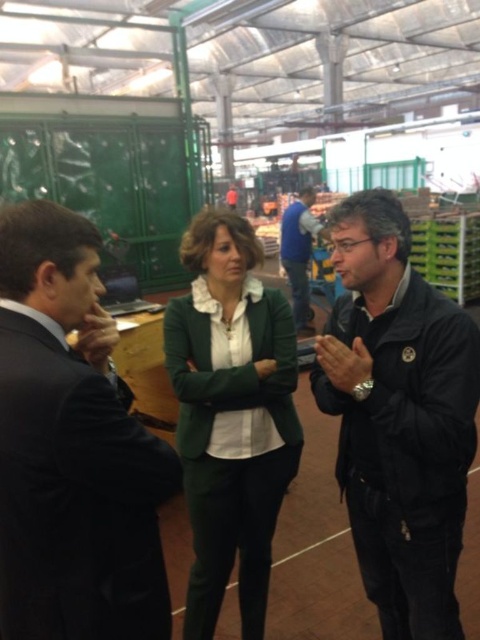
Is point (440, 472) farther from camera compared to point (253, 259)?

No, (440, 472) is closer to viewer.

Who is more distant from viewer, (430,456) or (267,461)?

Positioned behind is point (267,461).

Identify the location of black matte jacket at right. This screenshot has width=480, height=640. (398, 417).

Is black suit at left positioned in front of blue denim jeans at center?

Yes, it is.

Can you confirm if black suit at left is positioned to the left of blue denim jeans at center?

Correct, you'll find black suit at left to the left of blue denim jeans at center.

This screenshot has height=640, width=480. Describe the element at coordinates (72, 449) in the screenshot. I see `black suit at left` at that location.

Identify the location of black suit at left. (72, 449).

Between black matte jacket at right and blue denim jeans at center, which one is positioned higher?

Positioned higher is blue denim jeans at center.

Which of these two, black matte jacket at right or blue denim jeans at center, stands shorter?

With less height is black matte jacket at right.

Between point (365, 312) and point (290, 275), which one is positioned in front?

Point (365, 312)

This screenshot has width=480, height=640. In order to click on black matte jacket at right in this screenshot , I will do `click(398, 417)`.